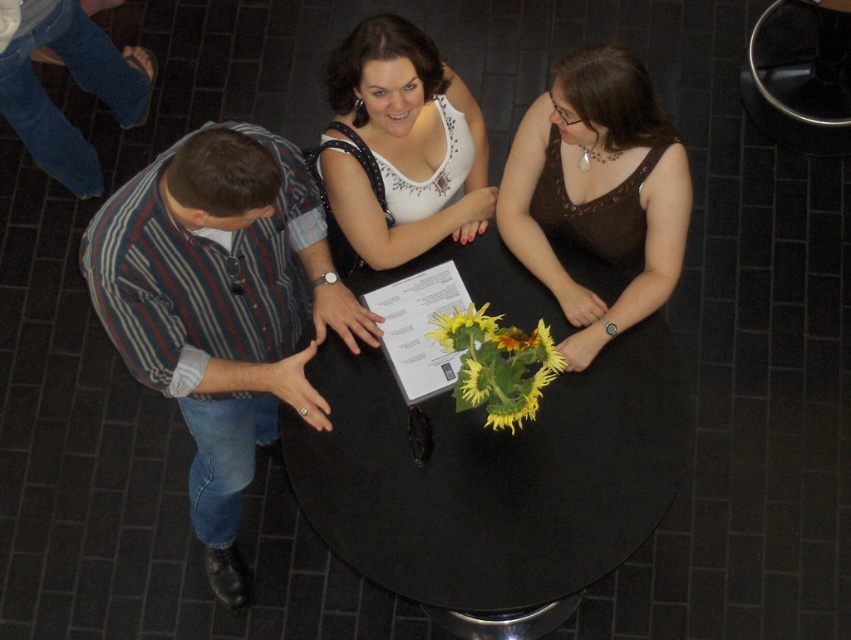
Question: Which of these objects is positioned closest to the brown satin tank top at center?

Choices:
 (A) black matte table at center
 (B) striped cotton shirt at left

Answer: (A)

Question: Is black matte table at center wider than brown satin tank top at center?

Choices:
 (A) yes
 (B) no

Answer: (A)

Question: Does black matte table at center appear on the left side of brown satin tank top at center?

Choices:
 (A) no
 (B) yes

Answer: (B)

Question: Among these points, which one is farthest from the camera?

Choices:
 (A) (346, 145)
 (B) (647, 156)
 (C) (198, 136)

Answer: (A)

Question: From the image, what is the correct spatial relationship of brown satin tank top at center in relation to yellow matte sunflowers at center?

Choices:
 (A) right
 (B) left

Answer: (A)

Question: Which of the following is the farthest from the observer?

Choices:
 (A) striped cotton shirt at left
 (B) white sequined top at center
 (C) brown satin tank top at center

Answer: (B)